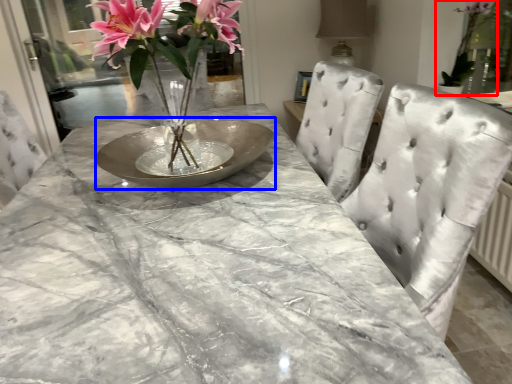
Question: Which of the following is the closest to the observer, houseplant (highlighted by a red box) or glass plate (highlighted by a blue box)?

Choices:
 (A) houseplant
 (B) glass plate

Answer: (B)